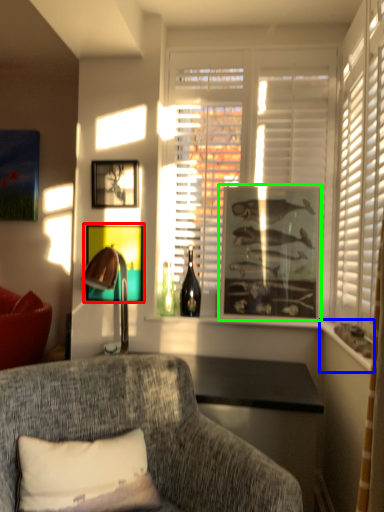
Question: Which is farther away from picture frame (highlighted by a red box)? window sill (highlighted by a blue box) or picture frame (highlighted by a green box)?

Choices:
 (A) window sill
 (B) picture frame

Answer: (A)